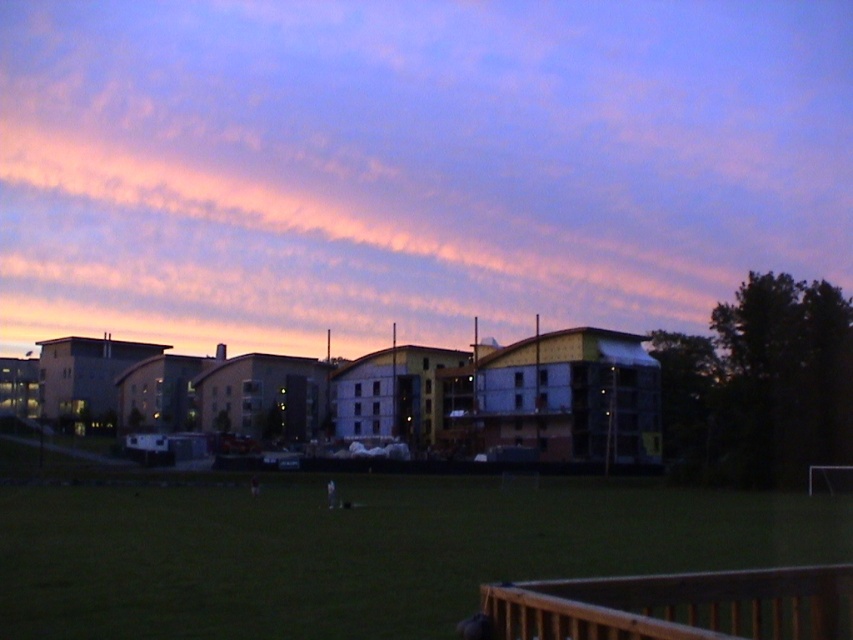
You are an architect planning to take a photo of the pink cloud at upper center and the green grass at center. Which object should you focus on first if you want to capture both in the same frame without moving the camera?

You should focus on the pink cloud at upper center first because it is larger than the green grass at center, allowing it to be more prominently featured in the frame while still including the smaller green grass at center.

From the picture: You are a gardener who needs to mow the lawn. You see the green grass at center and the brown wooden rail at lower right. Which object is taller and requires more attention to avoid hitting the rail while mowing?

The green grass at center is taller than the brown wooden rail at lower right, so you should focus on lowering the mower height to accommodate the taller grass without hitting the rail.